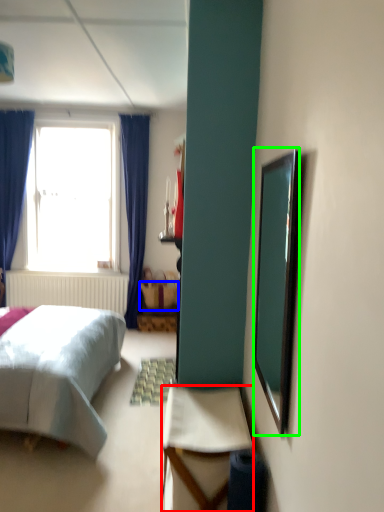
Question: Estimate the real-world distances between objects in this image. Which object is closer to desk (highlighted by a red box), picnic basket (highlighted by a blue box) or mirror (highlighted by a green box)?

Choices:
 (A) picnic basket
 (B) mirror

Answer: (B)